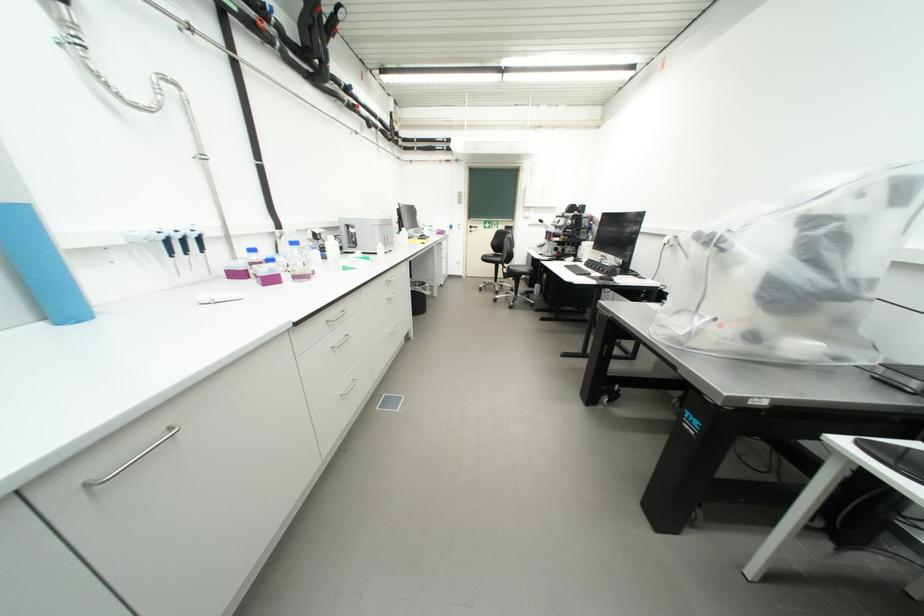
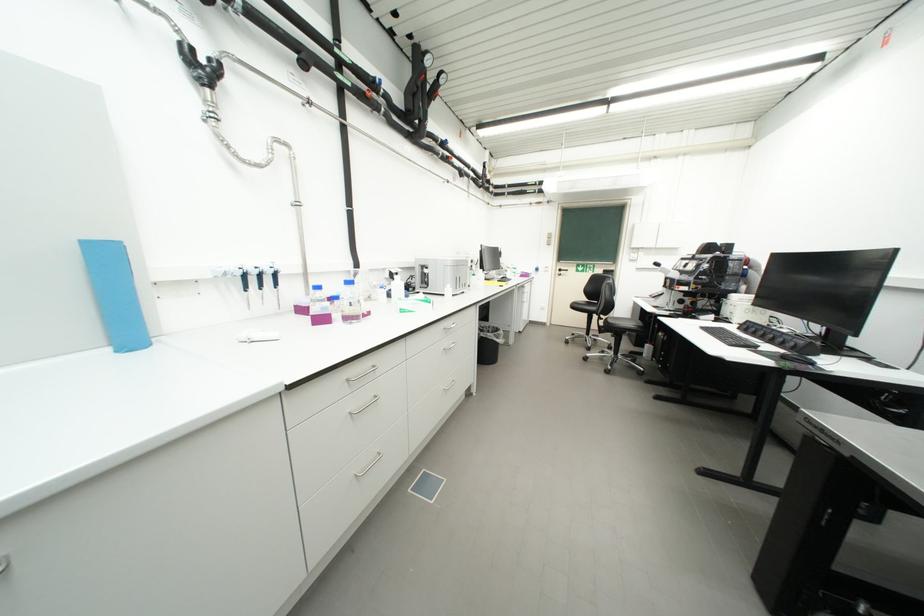
Find the pixel in the second image that matches pixel 319 238 in the first image.

(395, 277)